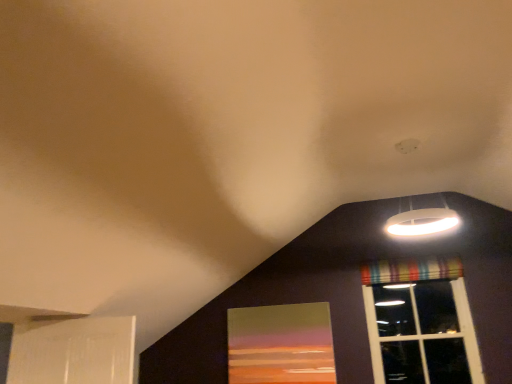
Question: Does white matte lampshade at upper right have a lesser height compared to matte glass window screen at lower center?

Choices:
 (A) no
 (B) yes

Answer: (B)

Question: Is white matte lampshade at upper right positioned with its back to matte glass window screen at lower center?

Choices:
 (A) no
 (B) yes

Answer: (A)

Question: Does white matte lampshade at upper right have a greater height compared to matte glass window screen at lower center?

Choices:
 (A) yes
 (B) no

Answer: (B)

Question: Is white matte lampshade at upper right further to camera compared to matte glass window screen at lower center?

Choices:
 (A) no
 (B) yes

Answer: (A)

Question: Considering the relative sizes of white matte lampshade at upper right and matte glass window screen at lower center in the image provided, is white matte lampshade at upper right smaller than matte glass window screen at lower center?

Choices:
 (A) yes
 (B) no

Answer: (B)

Question: Looking at the image, does striped fabric curtain at upper right seem bigger or smaller compared to matte glass window screen at lower center?

Choices:
 (A) big
 (B) small

Answer: (B)

Question: Is striped fabric curtain at upper right inside or outside of matte glass window screen at lower center?

Choices:
 (A) outside
 (B) inside

Answer: (A)

Question: In terms of width, does striped fabric curtain at upper right look wider or thinner when compared to matte glass window screen at lower center?

Choices:
 (A) thin
 (B) wide

Answer: (B)

Question: Considering the relative positions of striped fabric curtain at upper right and matte glass window screen at lower center in the image provided, is striped fabric curtain at upper right to the left or to the right of matte glass window screen at lower center?

Choices:
 (A) right
 (B) left

Answer: (A)

Question: Looking at their shapes, would you say striped fabric curtain at upper right is wider or thinner than white matte lampshade at upper right?

Choices:
 (A) thin
 (B) wide

Answer: (A)

Question: From the image's perspective, relative to white matte lampshade at upper right, is striped fabric curtain at upper right above or below?

Choices:
 (A) above
 (B) below

Answer: (B)

Question: Is striped fabric curtain at upper right taller or shorter than white matte lampshade at upper right?

Choices:
 (A) short
 (B) tall

Answer: (A)

Question: From a real-world perspective, relative to white matte lampshade at upper right, is striped fabric curtain at upper right vertically above or below?

Choices:
 (A) below
 (B) above

Answer: (A)

Question: In terms of height, does matte glass window screen at lower center look taller or shorter compared to striped fabric curtain at upper right?

Choices:
 (A) tall
 (B) short

Answer: (A)

Question: Based on their sizes in the image, would you say matte glass window screen at lower center is bigger or smaller than striped fabric curtain at upper right?

Choices:
 (A) big
 (B) small

Answer: (A)